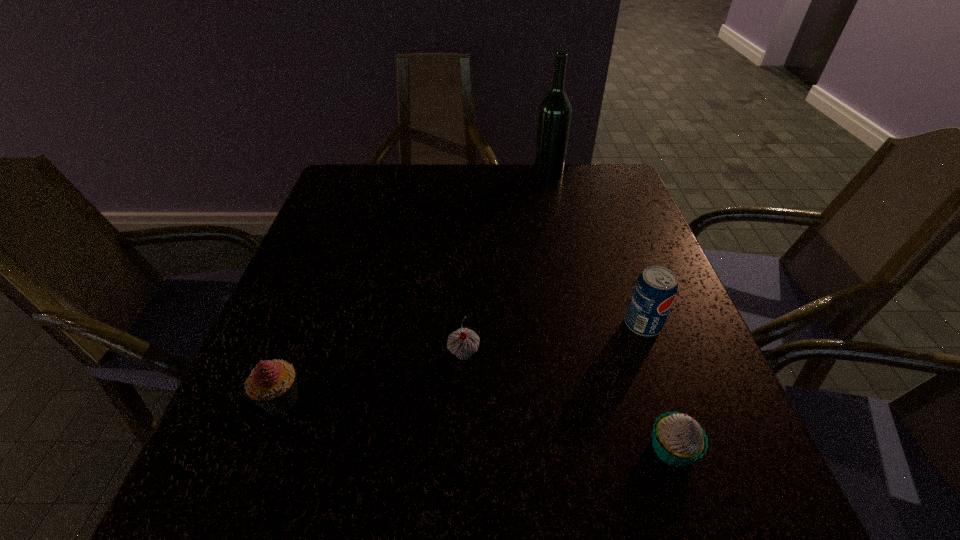
Where is `free space located 0.280m on the front of the third object from left to right`? The width and height of the screenshot is (960, 540). free space located 0.280m on the front of the third object from left to right is located at coordinates (564, 238).

Where is `free location located 0.390m on the back of the fourth nearest object`? Image resolution: width=960 pixels, height=540 pixels. free location located 0.390m on the back of the fourth nearest object is located at coordinates (600, 205).

What are the coordinates of `free space located 0.140m on the right of the leftmost object` in the screenshot? It's located at (386, 399).

The height and width of the screenshot is (540, 960). What are the coordinates of `vacant space located 0.120m on the left of the second object from left to right` in the screenshot? It's located at (384, 354).

At what (x,y) coordinates should I click in order to perform the action: click on free space located 0.100m on the left of the nearest object. Please return your answer as a coordinate pair (x, y). Looking at the image, I should click on (584, 448).

Where is `object located in the far edge section of the desktop`? The width and height of the screenshot is (960, 540). object located in the far edge section of the desktop is located at coordinates (554, 117).

Identify the location of object that is at the near edge. (678, 439).

What are the coordinates of `object positioned at the left edge` in the screenshot? It's located at pyautogui.click(x=272, y=385).

This screenshot has height=540, width=960. I want to click on pop present at the right edge, so click(x=655, y=290).

The image size is (960, 540). Identify the location of cupcake that is at the right edge. (678, 439).